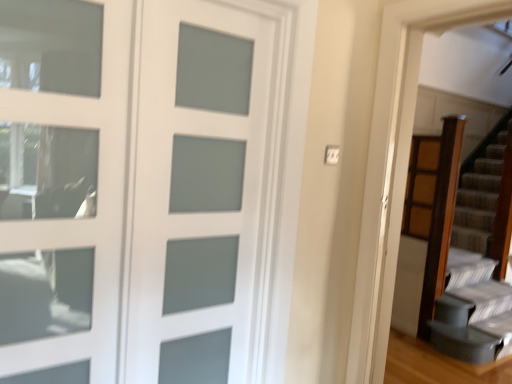
Question: Are satin glass door at upper left and white frosted glass door at center located far from each other?

Choices:
 (A) no
 (B) yes

Answer: (A)

Question: Considering the relative sizes of satin glass door at upper left and white frosted glass door at center in the image provided, is satin glass door at upper left bigger than white frosted glass door at center?

Choices:
 (A) yes
 (B) no

Answer: (B)

Question: Are satin glass door at upper left and white frosted glass door at center beside each other?

Choices:
 (A) yes
 (B) no

Answer: (B)

Question: Can white frosted glass door at center be found inside satin glass door at upper left?

Choices:
 (A) yes
 (B) no

Answer: (B)

Question: Does satin glass door at upper left have a smaller size compared to white frosted glass door at center?

Choices:
 (A) yes
 (B) no

Answer: (A)

Question: From the image's perspective, is satin glass door at upper left located above white frosted glass door at center?

Choices:
 (A) no
 (B) yes

Answer: (B)

Question: Does white frosted glass door at center have a lesser width compared to satin glass door at upper left?

Choices:
 (A) no
 (B) yes

Answer: (A)

Question: Would you say satin glass door at upper left is part of white frosted glass door at center's contents?

Choices:
 (A) yes
 (B) no

Answer: (B)

Question: Is white frosted glass door at center not inside satin glass door at upper left?

Choices:
 (A) yes
 (B) no

Answer: (A)

Question: Would you consider white frosted glass door at center to be distant from satin glass door at upper left?

Choices:
 (A) yes
 (B) no

Answer: (B)

Question: Considering the relative sizes of white frosted glass door at center and satin glass door at upper left in the image provided, is white frosted glass door at center bigger than satin glass door at upper left?

Choices:
 (A) yes
 (B) no

Answer: (A)

Question: From the image's perspective, is white frosted glass door at center under satin glass door at upper left?

Choices:
 (A) yes
 (B) no

Answer: (A)

Question: In the image, is white frosted glass door at center positioned in front of or behind satin glass door at upper left?

Choices:
 (A) front
 (B) behind

Answer: (B)